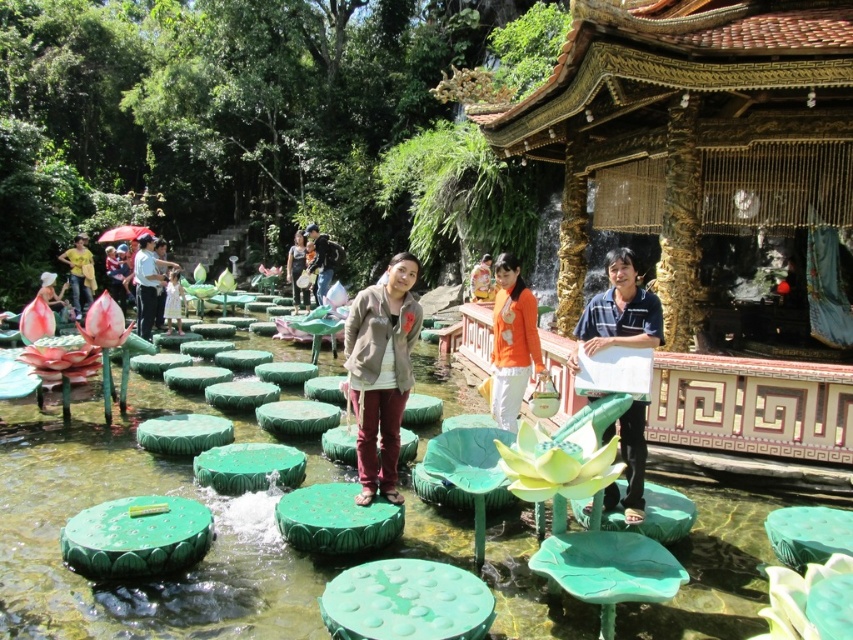
You are standing at the edge of the pond and want to place a small decorative statue. You have two points marked in the scene, point [395,368] and point [90,301]. Which point is better to place the statue so it is closer to you?

Point [395,368] is closer to the viewer than point [90,301], so placing the statue at point [395,368] would make it closer to you.

You are a photographer trying to capture a clear shot of the matte black shirt at center and the yellow matte shirt at center. Since the two are positioned close to each other, will you need to adjust your focus to include both in the frame?

The matte black shirt at center is in front of the yellow matte shirt at center, so you can focus on the matte black shirt at center and still have the yellow matte shirt at center in the background of the same frame without needing to adjust focus further.

You are a photographer trying to capture a group photo of the matte gray jacket at center and the yellow matte shirt at center. Which person should you position to the left in the frame to ensure they are both in the shot?

The yellow matte shirt at center should be positioned to the left because the matte gray jacket at center is currently on the right side of the yellow matte shirt at center, so placing the yellow matte shirt at center on the left would maintain their relative positions for the photo.